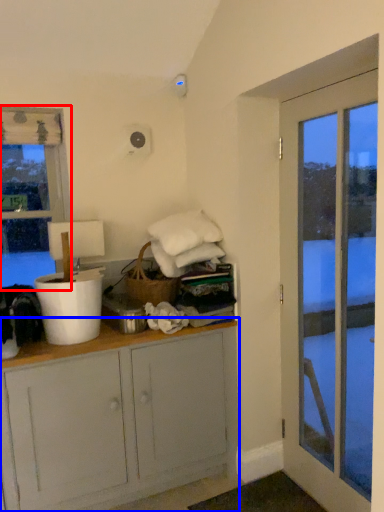
Question: Which point is closer to the camera, window (highlighted by a red box) or cabinetry (highlighted by a blue box)?

Choices:
 (A) window
 (B) cabinetry

Answer: (B)